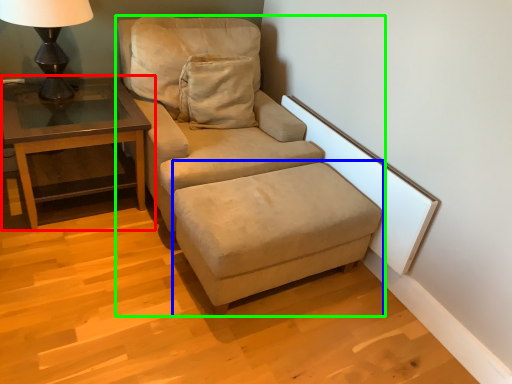
Question: Which object is the closest to the table (highlighted by a red box)? Choose among these: footrest (highlighted by a blue box) or studio couch (highlighted by a green box).

Choices:
 (A) footrest
 (B) studio couch

Answer: (B)